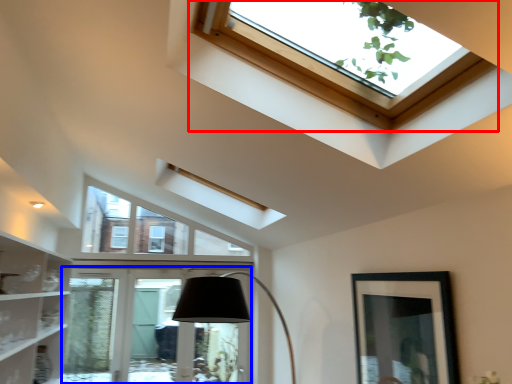
Question: Among these objects, which one is farthest to the camera, window (highlighted by a red box) or glass door (highlighted by a blue box)?

Choices:
 (A) window
 (B) glass door

Answer: (B)